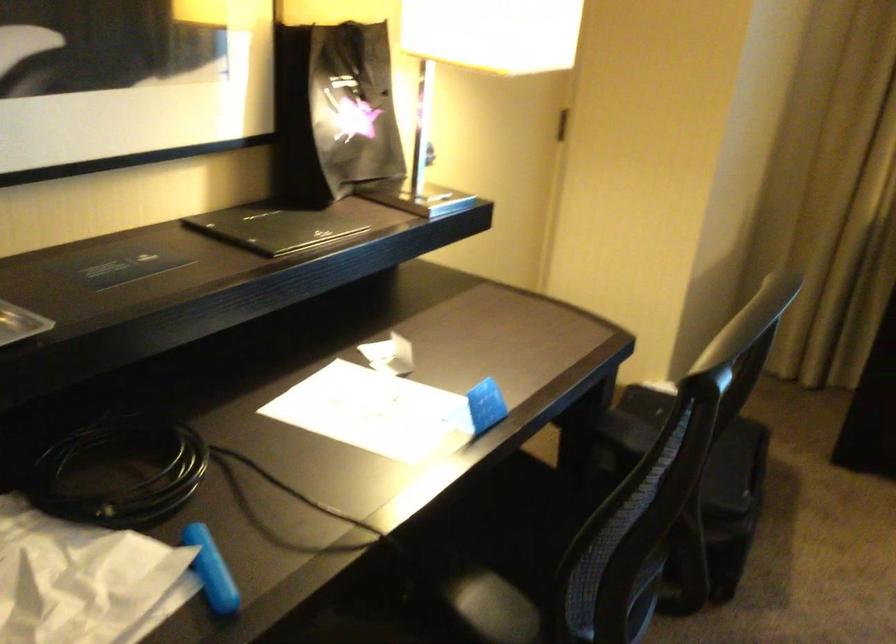
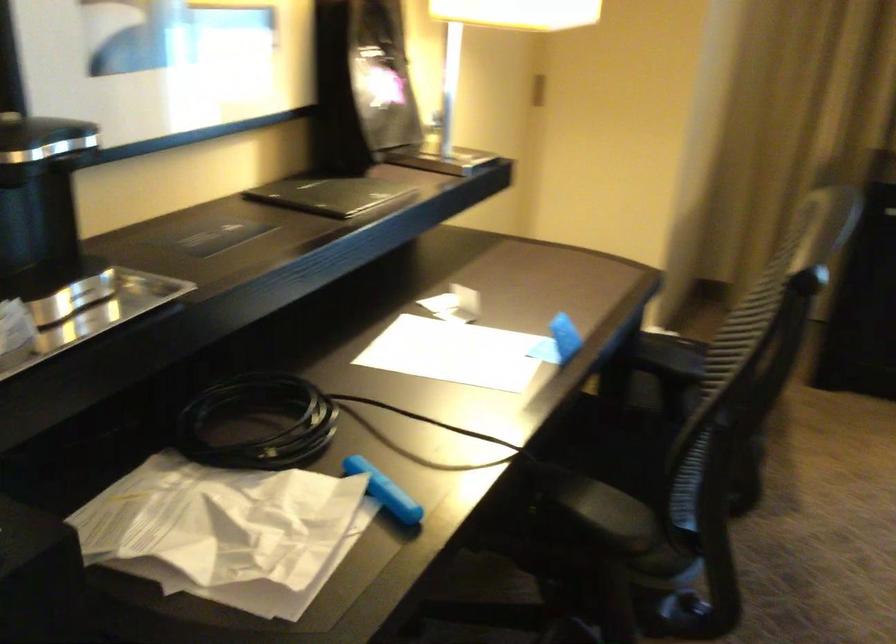
Find the pixel in the second image that matches point 212,569 in the first image.

(384, 491)